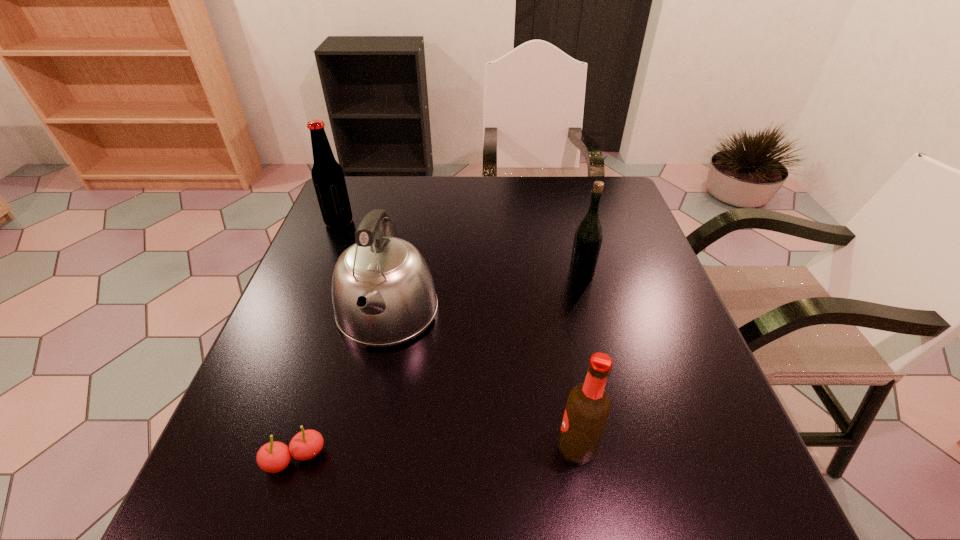
Identify which beer bottle is the third closest to the kettle. Please provide its 2D coordinates. Your answer should be formatted as a tuple, i.e. [(x, y)], where the tuple contains the x and y coordinates of a point satisfying the conditions above.

[(587, 242)]

The image size is (960, 540). In order to click on free space that satisfies the following two spatial constraints: 1. on the front side of the farthest object; 2. on the left side of the rightmost beer bottle in this screenshot , I will do `click(318, 275)`.